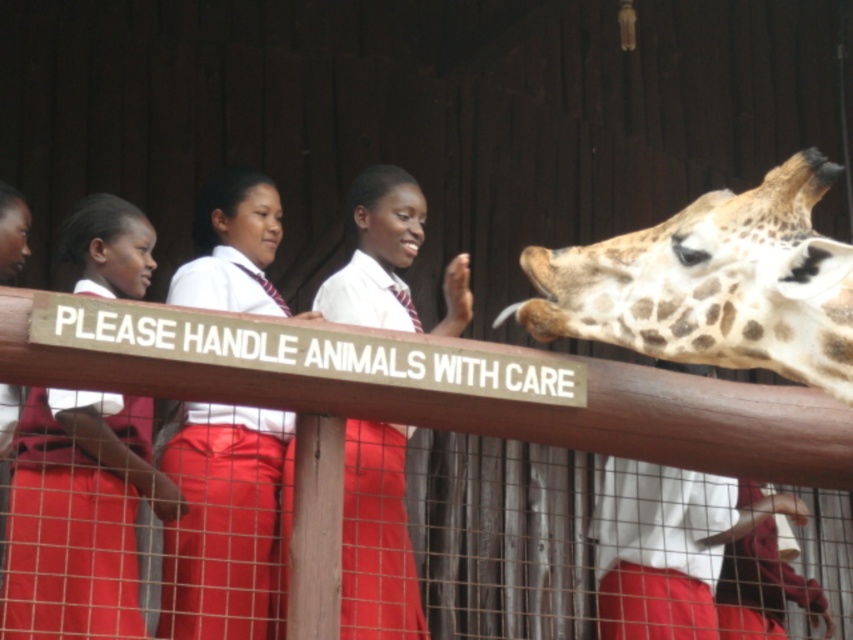
Question: Does spotted fur giraffe at right appear on the left side of matte white shirt at center?

Choices:
 (A) yes
 (B) no

Answer: (B)

Question: Can you confirm if matte white shirt at center is smaller than white shirt at center?

Choices:
 (A) no
 (B) yes

Answer: (B)

Question: Considering the relative positions of matte white shirt at center and white shirt at center in the image provided, where is matte white shirt at center located with respect to white shirt at center?

Choices:
 (A) above
 (B) below

Answer: (B)

Question: Which point appears closest to the camera in this image?

Choices:
 (A) (357, 280)
 (B) (606, 289)
 (C) (67, 385)

Answer: (C)

Question: Which of the following is the closest to the observer?

Choices:
 (A) white shirt at center
 (B) matte white shirt at center
 (C) spotted fur giraffe at right
 (D) matte red uniform at center

Answer: (C)

Question: Estimate the real-world distances between objects in this image. Which object is closer to the matte red uniform at center?

Choices:
 (A) white shirt at center
 (B) spotted fur giraffe at right
 (C) matte white shirt at center

Answer: (C)